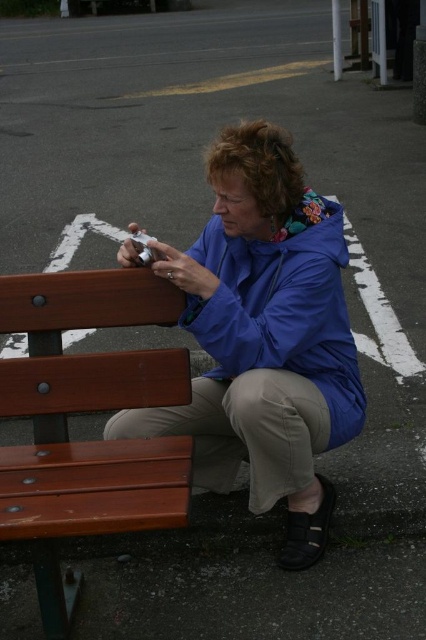
You are a fashion designer observing two jackets worn by a person sitting on a bench. The jackets are labeled as the blue fabric jacket at center and the blue matte jacket at center. Which jacket appears to be in front?

The blue fabric jacket at center is closer to the viewer than the blue matte jacket at center, so the blue fabric jacket at center appears to be in front.

Looking at this image, you are a delivery robot with a box that is 18 inches wide. You need to pass between the wooden bench at lower left and the blue matte jacket at center. Can you fit through the space?

The distance between the wooden bench at lower left and the blue matte jacket at center is 16.66 inches, which is narrower than the 18 inches width of the box. Therefore, the robot cannot fit through the space.